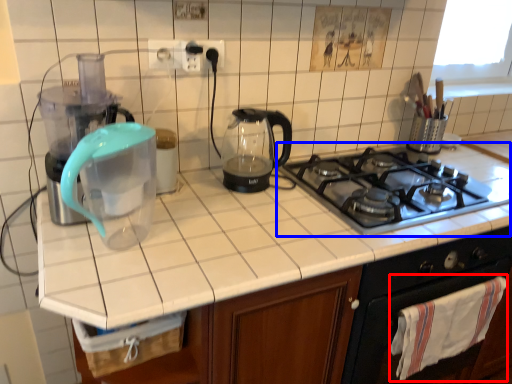
Question: Which object appears farthest to the camera in this image, cloth (highlighted by a red box) or gas stove (highlighted by a blue box)?

Choices:
 (A) cloth
 (B) gas stove

Answer: (A)